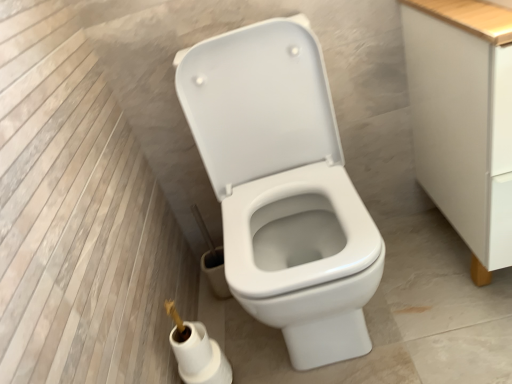
Question: Does point (454, 192) appear closer or farther from the camera than point (332, 274)?

Choices:
 (A) farther
 (B) closer

Answer: (A)

Question: Is white matte cabinet at right wider or thinner than white glossy toilet at center?

Choices:
 (A) thin
 (B) wide

Answer: (A)

Question: Estimate the real-world distances between objects in this image. Which object is closer to the white matte toilet paper at lower center?

Choices:
 (A) white glossy toilet at center
 (B) white matte cabinet at right

Answer: (A)

Question: Which of these objects is positioned farthest from the white glossy toilet at center?

Choices:
 (A) white matte toilet paper at lower center
 (B) white matte cabinet at right

Answer: (A)